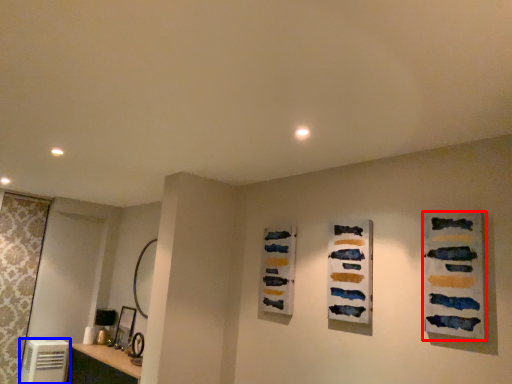
Question: Which object is further to the camera taking this photo, art (highlighted by a red box) or appliance (highlighted by a blue box)?

Choices:
 (A) art
 (B) appliance

Answer: (B)